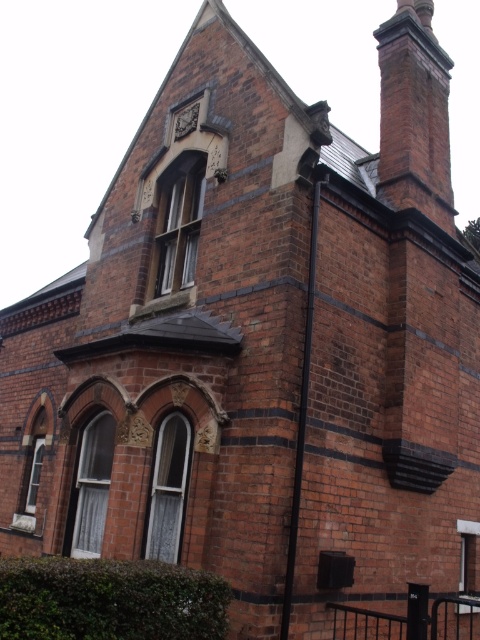
Is brick chimney at upper right above dark brown stone clock at upper center?

Indeed, brick chimney at upper right is positioned over dark brown stone clock at upper center.

Can you confirm if brick chimney at upper right is positioned below dark brown stone clock at upper center?

No, brick chimney at upper right is not below dark brown stone clock at upper center.

Measure the distance between point (x=403, y=148) and camera.

Point (x=403, y=148) and camera are 104.50 feet apart.

Where is `brick chimney at upper right`? Image resolution: width=480 pixels, height=640 pixels. brick chimney at upper right is located at coordinates (415, 115).